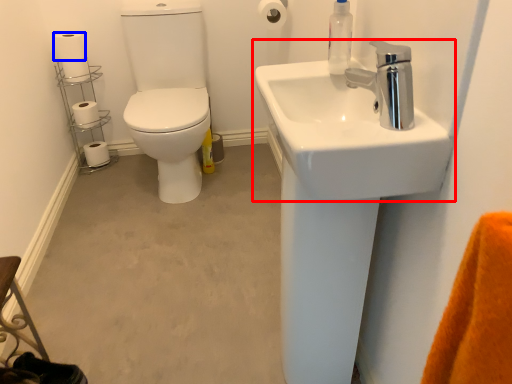
Question: Which object is closer to the camera taking this photo, sink (highlighted by a red box) or toilet paper (highlighted by a blue box)?

Choices:
 (A) sink
 (B) toilet paper

Answer: (A)